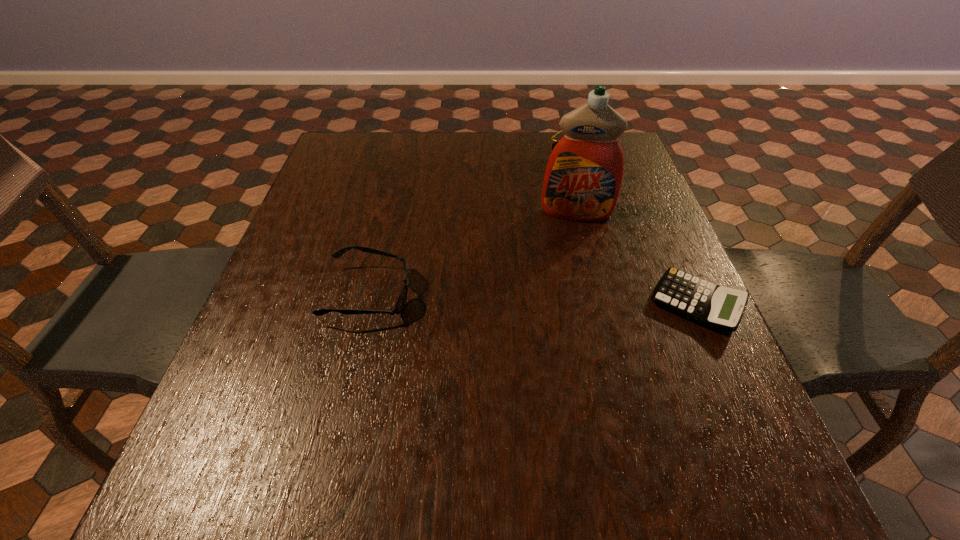
The image size is (960, 540). Find the location of `vacant spot on the desktop that is between the left sunglasses and the shortest object and is positioned on the front surface of the third nearest object`. vacant spot on the desktop that is between the left sunglasses and the shortest object and is positioned on the front surface of the third nearest object is located at coordinates (580, 300).

Where is `vacant space on the desktop that is between the left sunglasses and the shortest object and is positioned on the front-facing side of the right sunglasses`? vacant space on the desktop that is between the left sunglasses and the shortest object and is positioned on the front-facing side of the right sunglasses is located at coordinates (484, 298).